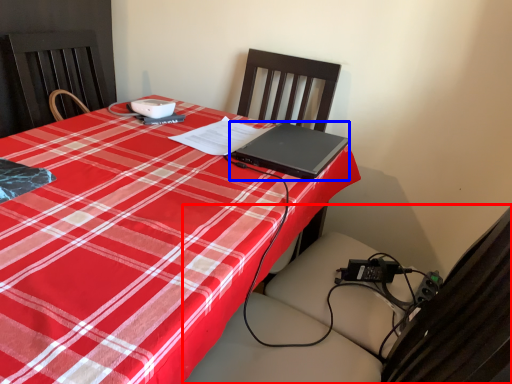
Question: Which object appears farthest to the camera in this image, swivel chair (highlighted by a red box) or laptop (highlighted by a blue box)?

Choices:
 (A) swivel chair
 (B) laptop

Answer: (B)